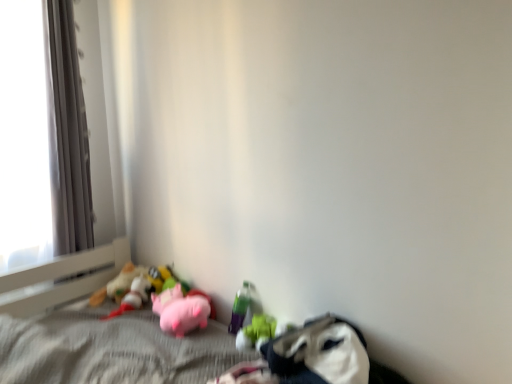
Question: Is white plastic window frame at left closer to camera compared to pink plush pig at center?

Choices:
 (A) yes
 (B) no

Answer: (B)

Question: Considering the relative positions of white plastic window frame at left and pink plush pig at center in the image provided, is white plastic window frame at left behind pink plush pig at center?

Choices:
 (A) no
 (B) yes

Answer: (B)

Question: From a real-world perspective, is white plastic window frame at left located beneath pink plush pig at center?

Choices:
 (A) yes
 (B) no

Answer: (B)

Question: Is white plastic window frame at left looking in the opposite direction of pink plush pig at center?

Choices:
 (A) no
 (B) yes

Answer: (A)

Question: Is white plastic window frame at left bigger than pink plush pig at center?

Choices:
 (A) no
 (B) yes

Answer: (B)

Question: Does white plastic window frame at left have a greater width compared to pink plush pig at center?

Choices:
 (A) no
 (B) yes

Answer: (A)

Question: Is pink plush toys at lower left further to camera compared to pink plush pig at lower center, the third toy when ordered from right to left?

Choices:
 (A) no
 (B) yes

Answer: (A)

Question: Is pink plush toys at lower left not inside pink plush pig at lower center, which is the 2th toy in left-to-right order?

Choices:
 (A) yes
 (B) no

Answer: (A)

Question: Is pink plush pig at lower center, the third toy when ordered from right to left, at the back of pink plush toys at lower left?

Choices:
 (A) no
 (B) yes

Answer: (A)

Question: Can you confirm if pink plush toys at lower left is shorter than pink plush pig at lower center, which is the 2th toy in left-to-right order?

Choices:
 (A) yes
 (B) no

Answer: (B)

Question: Is pink plush toys at lower left aimed at pink plush pig at lower center, the third toy when ordered from right to left?

Choices:
 (A) yes
 (B) no

Answer: (B)

Question: From a real-world perspective, is pink plush toys at lower left on top of pink plush pig at lower center, the third toy when ordered from right to left?

Choices:
 (A) no
 (B) yes

Answer: (A)

Question: From the image's perspective, would you say rubber duck at lower center, arranged as the 4th toy when viewed from the left, is positioned over pink plush pig at center?

Choices:
 (A) yes
 (B) no

Answer: (B)